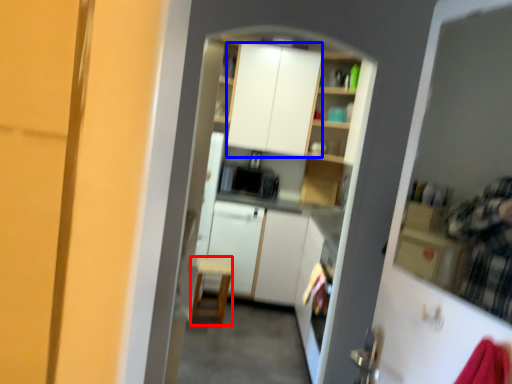
Question: Which point is further to the camera, chair (highlighted by a red box) or cabinetry (highlighted by a blue box)?

Choices:
 (A) chair
 (B) cabinetry

Answer: (B)